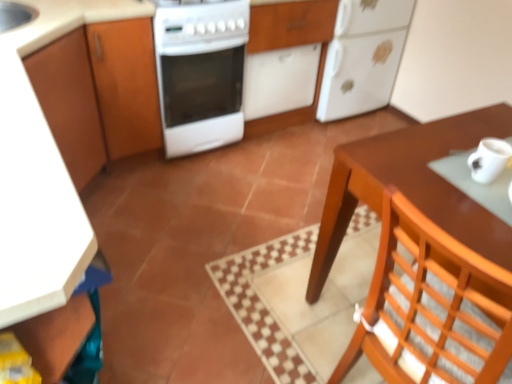
Where is `brown wooden table at right`? Image resolution: width=512 pixels, height=384 pixels. brown wooden table at right is located at coordinates (413, 186).

The height and width of the screenshot is (384, 512). What do you see at coordinates (432, 306) in the screenshot?
I see `wooden chair at lower right` at bounding box center [432, 306].

What do you see at coordinates (362, 57) in the screenshot? I see `white matte refrigerator at upper right` at bounding box center [362, 57].

This screenshot has height=384, width=512. Find the location of `white matte mug at right`. white matte mug at right is located at coordinates (489, 159).

Image resolution: width=512 pixels, height=384 pixels. I want to click on brown wooden table at right, so click(413, 186).

Which of these two, wooden cabinet at left, which is counted as the 1th cabinetry, starting from the left, or wooden chair at lower right, stands shorter?

wooden cabinet at left, which is counted as the 1th cabinetry, starting from the left.

From a real-world perspective, which is physically below, wooden cabinet at left, the second cabinetry in the right-to-left sequence, or wooden chair at lower right?

wooden cabinet at left, the second cabinetry in the right-to-left sequence, is physically lower.

Looking at their sizes, would you say wooden cabinet at left, the second cabinetry in the right-to-left sequence, is wider or thinner than wooden chair at lower right?

Considering their sizes, wooden cabinet at left, the second cabinetry in the right-to-left sequence, looks broader than wooden chair at lower right.

Which of these two, wooden cabinet at left, the second cabinetry in the right-to-left sequence, or brown wooden table at right, is bigger?

Bigger between the two is brown wooden table at right.

Where is `cabinetry that is the 1st one when counting backward from the brown wooden table at right`? The height and width of the screenshot is (384, 512). cabinetry that is the 1st one when counting backward from the brown wooden table at right is located at coordinates (99, 94).

Is wooden cabinet at left, the second cabinetry in the right-to-left sequence, surrounding brown wooden table at right?

Actually, brown wooden table at right is outside wooden cabinet at left, the second cabinetry in the right-to-left sequence.

Considering the sizes of wooden chair at lower right and white matte refrigerator at upper right in the image, is wooden chair at lower right bigger or smaller than white matte refrigerator at upper right?

Considering their sizes, wooden chair at lower right takes up less space than white matte refrigerator at upper right.

Image resolution: width=512 pixels, height=384 pixels. In order to click on kitchen appliance lying above the wooden chair at lower right (from the image's perspective) in this screenshot , I will do `click(362, 57)`.

From their relative heights in the image, would you say wooden chair at lower right is taller or shorter than white matte refrigerator at upper right?

Considering their sizes, wooden chair at lower right has more height than white matte refrigerator at upper right.

Does wooden chair at lower right have a lesser width compared to white matte refrigerator at upper right?

Correct, the width of wooden chair at lower right is less than that of white matte refrigerator at upper right.

Does white glossy stove at center contain brown wooden table at right?

Definitely not — brown wooden table at right is not inside white glossy stove at center.

What are the coordinates of `home appliance above the brown wooden table at right (from the image's perspective)` in the screenshot? It's located at (201, 74).

Who is taller, white glossy stove at center or brown wooden table at right?

Standing taller between the two is brown wooden table at right.

Visually, is white glossy stove at center positioned to the left or to the right of brown wooden table at right?

Clearly, white glossy stove at center is on the left of brown wooden table at right in the image.

Is white matte cabinet at center, the 2th cabinetry positioned from the left, behind white matte mug at right?

That is True.

Which object is wider, white matte cabinet at center, the 2th cabinetry positioned from the left, or white matte mug at right?

With larger width is white matte cabinet at center, the 2th cabinetry positioned from the left.

From the image's perspective, which cabinetry is the 2nd one above the white matte mug at right? Please provide its 2D coordinates.

[(291, 25)]

Is white matte cabinet at center, arranged as the first cabinetry when viewed from the right, taller than white matte mug at right?

Correct, white matte cabinet at center, arranged as the first cabinetry when viewed from the right, is much taller as white matte mug at right.

Image resolution: width=512 pixels, height=384 pixels. There is a wooden cabinet at left, which is counted as the 1th cabinetry, starting from the left. Find the location of `chair above it (from a real-world perspective)`. chair above it (from a real-world perspective) is located at coordinates (432, 306).

Is wooden chair at lower right shorter than wooden cabinet at left, which is counted as the 1th cabinetry, starting from the left?

In fact, wooden chair at lower right may be taller than wooden cabinet at left, which is counted as the 1th cabinetry, starting from the left.

Is wooden chair at lower right turned away from wooden cabinet at left, the second cabinetry in the right-to-left sequence?

wooden chair at lower right does not have its back to wooden cabinet at left, the second cabinetry in the right-to-left sequence.

Would you consider wooden chair at lower right to be distant from wooden cabinet at left, the second cabinetry in the right-to-left sequence?

That's right, there is a large distance between wooden chair at lower right and wooden cabinet at left, the second cabinetry in the right-to-left sequence.

Are brown wooden table at right and white glossy stove at center far apart?

A: Yes, brown wooden table at right and white glossy stove at center are quite far apart.

Is brown wooden table at right at the right side of white glossy stove at center?

Correct, you'll find brown wooden table at right to the right of white glossy stove at center.

Can you confirm if brown wooden table at right is smaller than white glossy stove at center?

Actually, brown wooden table at right might be larger than white glossy stove at center.

Which cabinetry is the 1st one when counting from the back of the wooden chair at lower right? Please provide its 2D coordinates.

[(99, 94)]

This screenshot has height=384, width=512. Identify the location of the 2nd cabinetry to the left when counting from the brown wooden table at right. (99, 94).

Estimate the real-world distances between objects in this image. Which object is closer to white matte mug at right, brown wooden table at right or white glossy stove at center?

Based on the image, brown wooden table at right appears to be nearer to white matte mug at right.

Looking at the image, which one is located closer to white matte refrigerator at upper right, white matte mug at right or brown wooden table at right?

brown wooden table at right is positioned closer to the anchor white matte refrigerator at upper right.

Estimate the real-world distances between objects in this image. Which object is further from wooden chair at lower right, white matte cabinet at center, the 2th cabinetry positioned from the left, or brown wooden table at right?

Among the two, white matte cabinet at center, the 2th cabinetry positioned from the left, is located further to wooden chair at lower right.

Consider the image. When comparing their distances from white glossy stove at center, does wooden chair at lower right or white matte refrigerator at upper right seem further?

→ wooden chair at lower right is further to white glossy stove at center.

Estimate the real-world distances between objects in this image. Which object is further from wooden cabinet at left, the second cabinetry in the right-to-left sequence, brown wooden table at right or white matte mug at right?

white matte mug at right lies further to wooden cabinet at left, the second cabinetry in the right-to-left sequence, than the other object.

Looking at the image, which one is located further to white matte mug at right, brown wooden table at right or white matte cabinet at center, arranged as the first cabinetry when viewed from the right?

white matte cabinet at center, arranged as the first cabinetry when viewed from the right.

Considering their positions, is brown wooden table at right positioned further to white glossy stove at center than wooden cabinet at left, which is counted as the 1th cabinetry, starting from the left?

brown wooden table at right.

Considering their positions, is wooden chair at lower right positioned further to wooden cabinet at left, which is counted as the 1th cabinetry, starting from the left, than white matte cabinet at center, the 2th cabinetry positioned from the left?

Among the two, wooden chair at lower right is located further to wooden cabinet at left, which is counted as the 1th cabinetry, starting from the left.

In order to click on chair between wooden cabinet at left, the second cabinetry in the right-to-left sequence, and white matte mug at right from left to right in this screenshot , I will do (x=432, y=306).

Image resolution: width=512 pixels, height=384 pixels. I want to click on mug positioned between brown wooden table at right and white matte cabinet at center, the 2th cabinetry positioned from the left, from near to far, so click(x=489, y=159).

This screenshot has height=384, width=512. Find the location of `mug situated between white glossy stove at center and brown wooden table at right from left to right`. mug situated between white glossy stove at center and brown wooden table at right from left to right is located at coordinates (489, 159).

The image size is (512, 384). Identify the location of home appliance between wooden chair at lower right and white matte refrigerator at upper right from front to back. (201, 74).